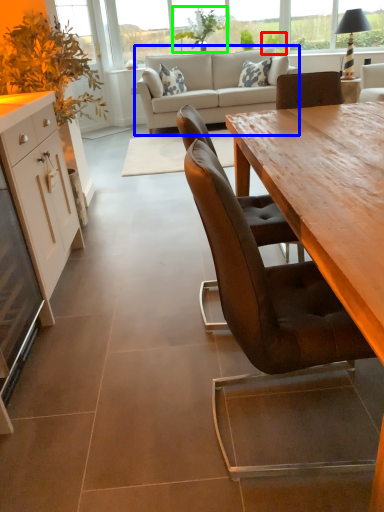
Question: Which object is the farthest from plant (highlighted by a red box)? Choose among these: studio couch (highlighted by a blue box) or plant (highlighted by a green box).

Choices:
 (A) studio couch
 (B) plant

Answer: (A)